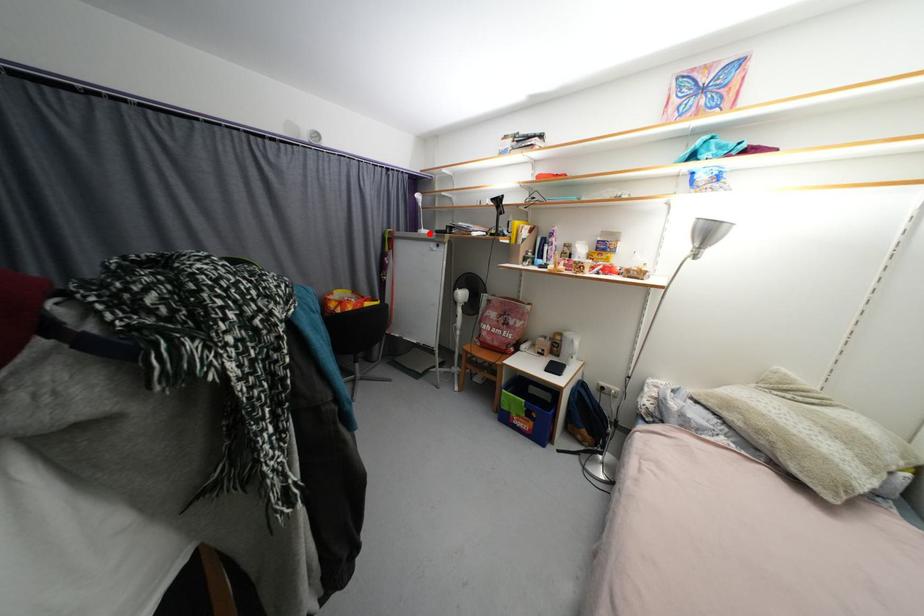
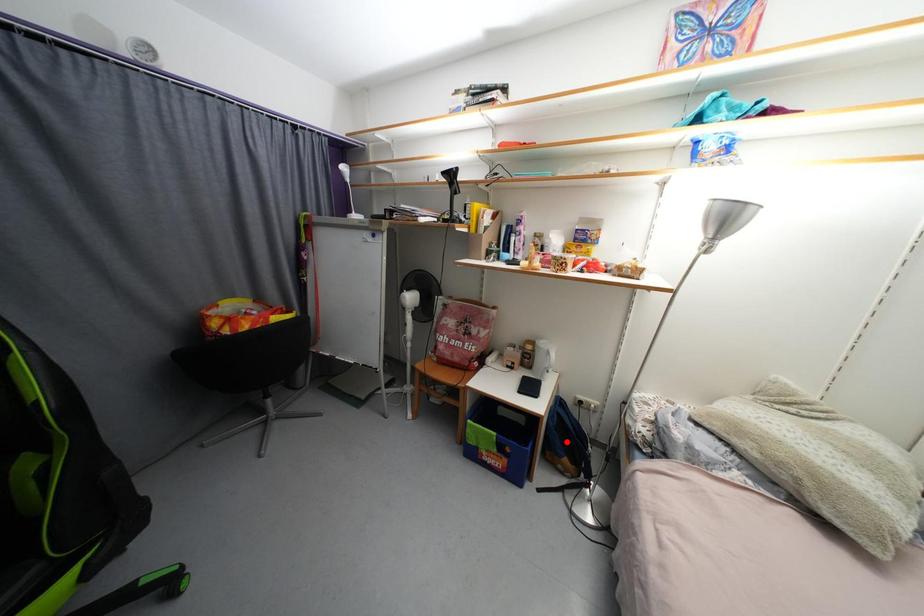
I am providing you with two images of the same scene from different viewpoints. A red point is marked on the first image and another point is marked on the second image. Does the point marked in image1 correspond to the same location as the one in image2?

No